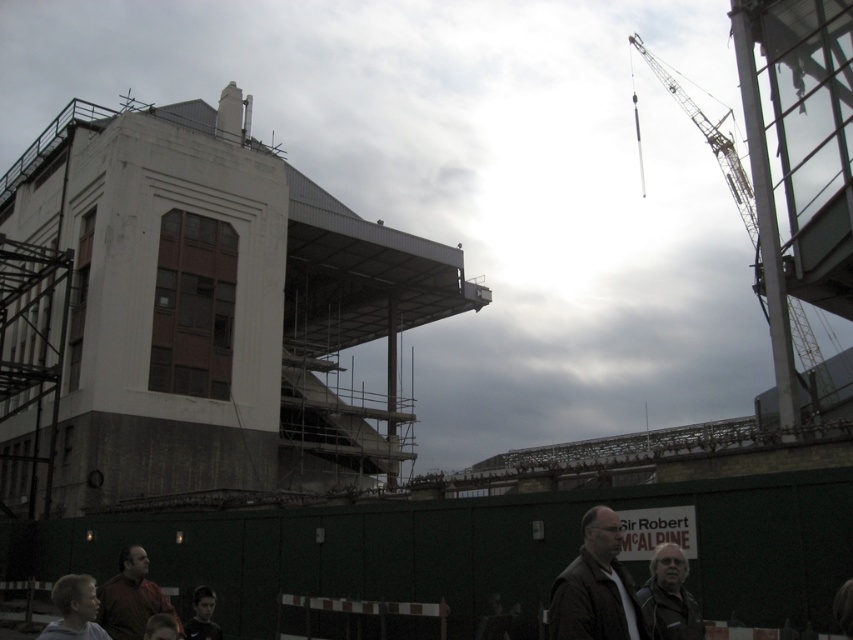
Who is higher up, white concrete building at left or dark brown leather jacket at lower right?

white concrete building at left

Does white concrete building at left have a smaller size compared to dark brown leather jacket at lower right?

Incorrect, white concrete building at left is not smaller in size than dark brown leather jacket at lower right.

Locate an element on the screen. This screenshot has height=640, width=853. white concrete building at left is located at coordinates (201, 314).

Find the location of `white concrete building at left`. white concrete building at left is located at coordinates (201, 314).

Which is below, brown leather jacket at lower left or dark gray jacket at lower right?

brown leather jacket at lower left is lower down.

Does brown leather jacket at lower left appear on the left side of dark gray jacket at lower right?

Yes, brown leather jacket at lower left is to the left of dark gray jacket at lower right.

Image resolution: width=853 pixels, height=640 pixels. I want to click on brown leather jacket at lower left, so click(131, 596).

Looking at this image, can you confirm if dark brown leather jacket at lower right is wider than brown leather jacket at lower left?

No.

Who is positioned more to the right, dark brown leather jacket at lower right or brown leather jacket at lower left?

dark brown leather jacket at lower right is more to the right.

Is point (602, 580) in front of point (115, 579)?

Yes, point (602, 580) is closer to viewer.

At what (x,y) coordinates should I click in order to perform the action: click on dark brown leather jacket at lower right. Please return your answer as a coordinate pair (x, y). The image size is (853, 640). Looking at the image, I should click on (595, 588).